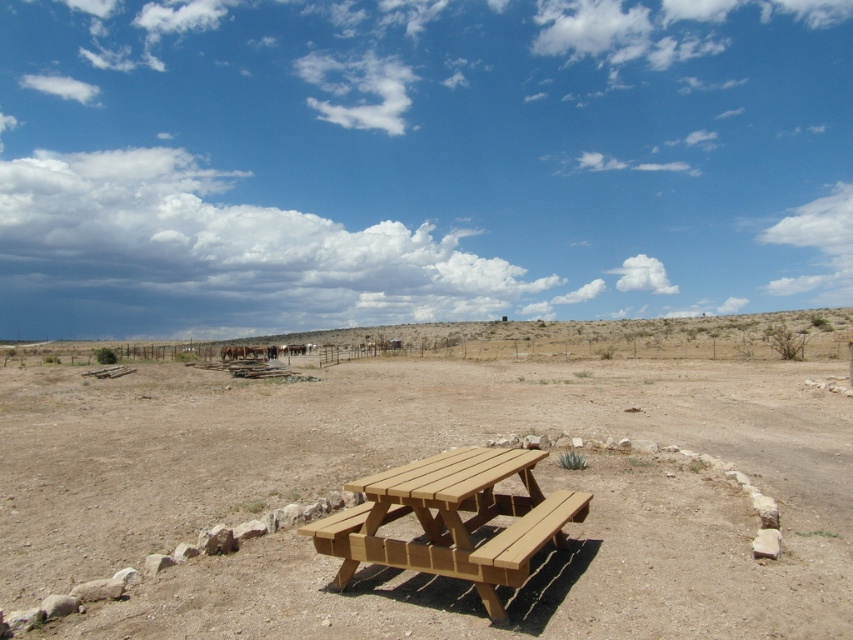
You are standing at the origin point of the coordinate system. You want to walk to the brown wood picnic table at center. What direction should you head?

The brown wood picnic table at center is located at coordinate point 0.717 on the x axis and 0.487 on the y axis, so you should head northeast to reach it.

You are planning to set up a picnic at the desert location shown. You see the brown wood picnic table at center and the wooden picnic table at center. Which one is positioned lower in the image?

The brown wood picnic table at center is located below the wooden picnic table at center, so it is positioned lower in the image.